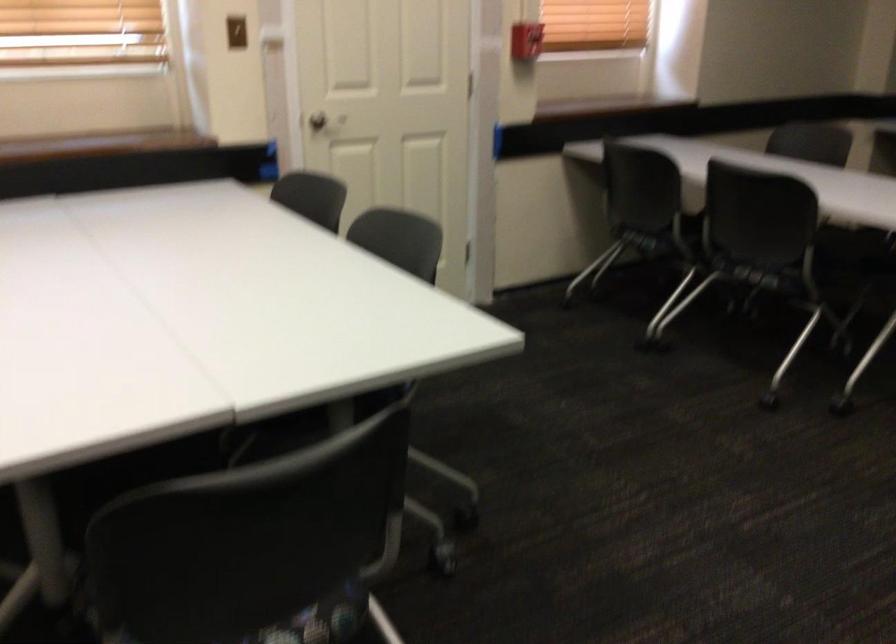
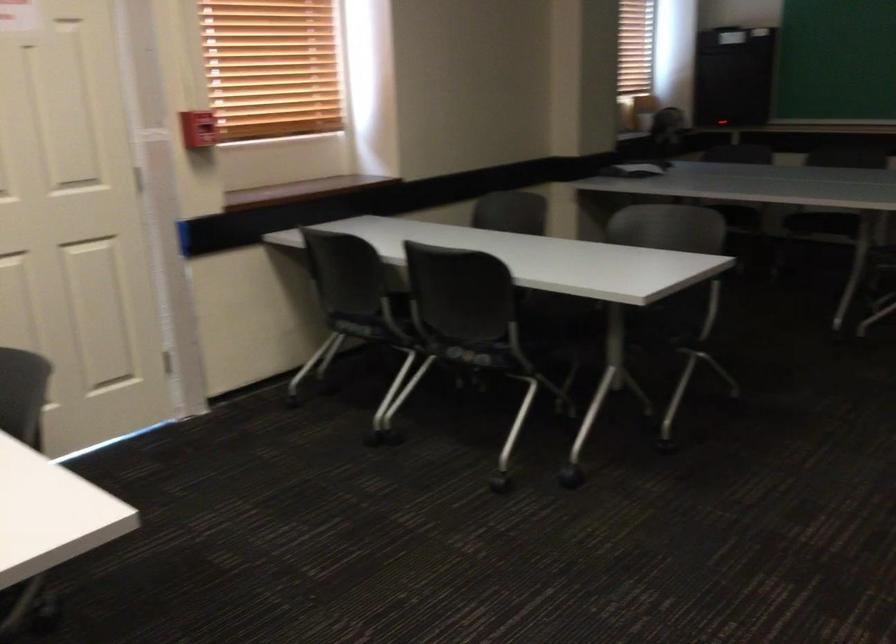
Find the pixel in the second image that matches the point at 650,238 in the first image.

(360, 328)